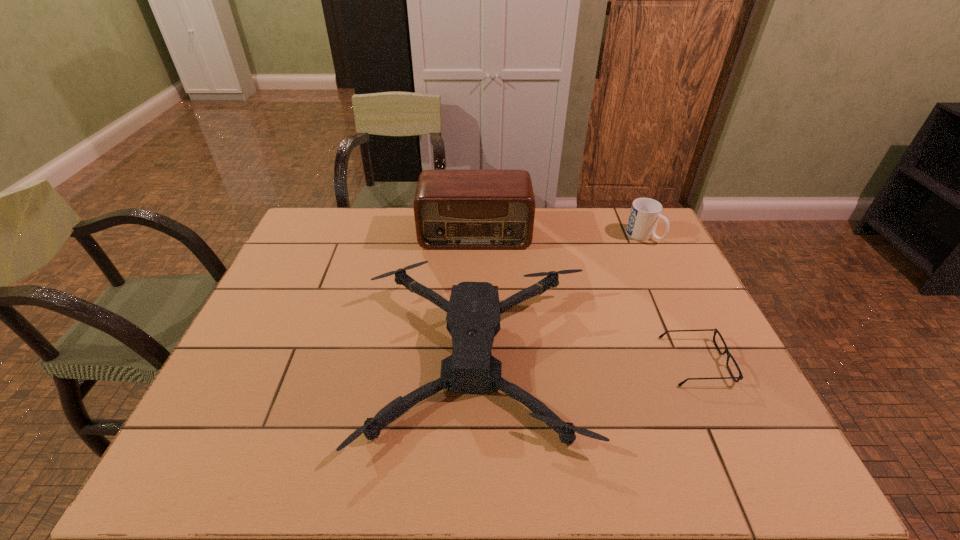
Find the location of a particular element. The height and width of the screenshot is (540, 960). mug located in the right edge section of the desktop is located at coordinates (645, 212).

This screenshot has width=960, height=540. In order to click on spectacles that is at the right edge in this screenshot , I will do [715, 330].

Where is `object that is at the far right corner`? object that is at the far right corner is located at coordinates (645, 212).

Where is `vacant region at the far edge of the desktop`? This screenshot has height=540, width=960. vacant region at the far edge of the desktop is located at coordinates (585, 225).

In the image, there is a desktop. Where is `vacant space at the near edge`? The width and height of the screenshot is (960, 540). vacant space at the near edge is located at coordinates (505, 474).

Image resolution: width=960 pixels, height=540 pixels. In the image, there is a desktop. Find the location of `vacant space at the left edge`. vacant space at the left edge is located at coordinates (288, 279).

The height and width of the screenshot is (540, 960). Find the location of `blank space at the right edge of the desktop`. blank space at the right edge of the desktop is located at coordinates (713, 421).

The image size is (960, 540). In the image, there is a desktop. In order to click on vacant space at the far left corner in this screenshot , I will do `click(310, 241)`.

Identify the location of vacant space at the near right corner of the desktop. Image resolution: width=960 pixels, height=540 pixels. (731, 448).

Identify the location of vacant region between the third tallest object and the mug. (561, 296).